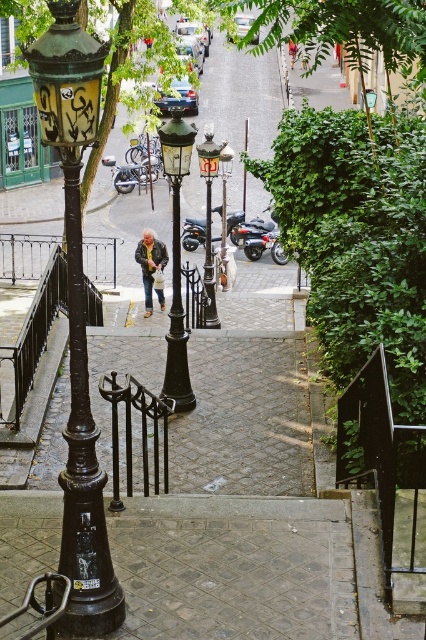
You are a tourist standing at the top of the stone steps and want to take a photo of the polished brass streetlight at center and the black metal rail at lower left. Which object should you focus on first if you want to capture both in the frame without moving your camera?

The polished brass streetlight at center is positioned on the right side of black metal rail at lower left, so you should focus on the black metal rail at lower left first to ensure both are in the frame.

You are standing at the top of the stone steps in the urban scene. You want to walk down to the polished brass streetlight at center. Which direction should you head?

You should head downward towards the polished brass streetlight at center since it is located below the stone steps.